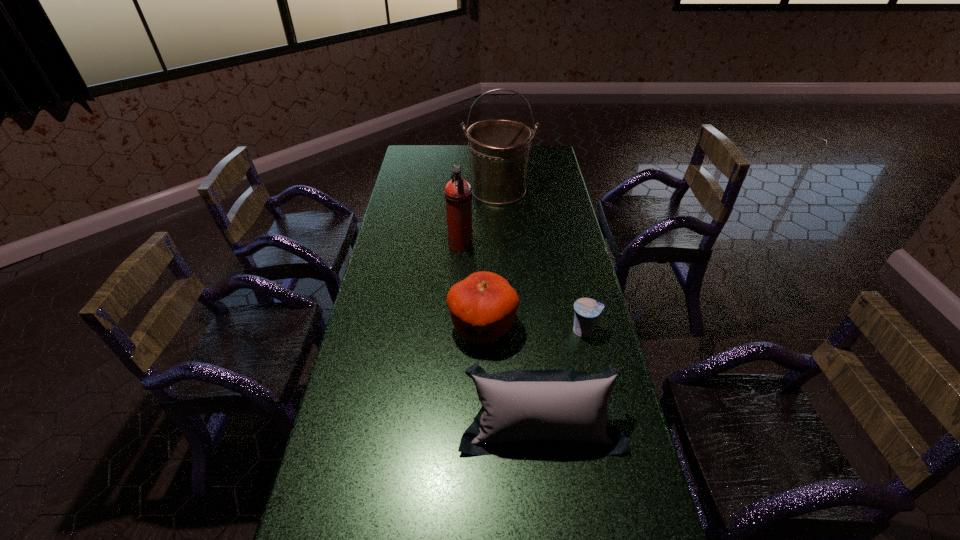
Find the location of `free space between the shortest object and the pumpkin`. free space between the shortest object and the pumpkin is located at coordinates (534, 328).

The height and width of the screenshot is (540, 960). In order to click on free space between the yogurt and the tallest object in this screenshot , I will do click(541, 261).

Locate an element on the screen. free space between the yogurt and the tallest object is located at coordinates (541, 261).

Locate which object is the closest to the pumpkin. Please provide its 2D coordinates. Your answer should be formatted as a tuple, i.e. [(x, y)], where the tuple contains the x and y coordinates of a point satisfying the conditions above.

[(565, 410)]

Where is `the second closest object to the tallest object`? This screenshot has width=960, height=540. the second closest object to the tallest object is located at coordinates (483, 306).

Where is `free location that satisfies the following two spatial constraints: 1. at the nozzle of the fourth nearest object; 2. on the back side of the pumpkin`? free location that satisfies the following two spatial constraints: 1. at the nozzle of the fourth nearest object; 2. on the back side of the pumpkin is located at coordinates (456, 327).

At what (x,y) coordinates should I click in order to perform the action: click on vacant space that satisfies the following two spatial constraints: 1. at the nozzle of the pumpkin; 2. on the right side of the fourth nearest object. Please return your answer as a coordinate pair (x, y). The height and width of the screenshot is (540, 960). Looking at the image, I should click on (456, 327).

This screenshot has height=540, width=960. I want to click on free space that satisfies the following two spatial constraints: 1. on the back side of the pumpkin; 2. at the nozzle of the fourth shortest object, so click(x=482, y=246).